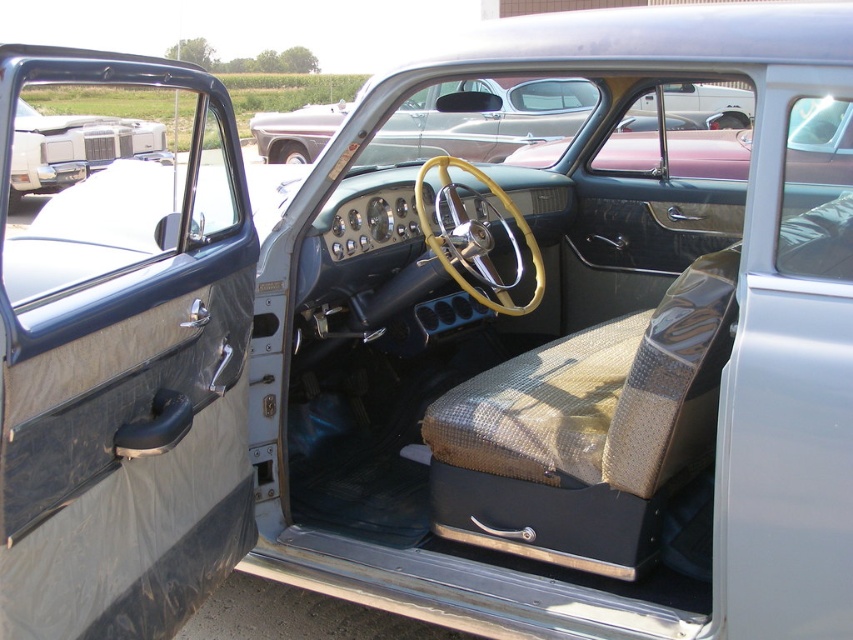
You are a delivery driver who needs to park your truck in a narrow alley. The alley is just wide enough for the metallic red pickup truck at center. Can the matte gray door at left fit through the same alley without opening wider?

The matte gray door at left is wider than the metallic red pickup truck at center, so it cannot fit through the alley without opening wider.

You are standing outside the matte gray door at left and want to enter the metallic red pickup truck at center. Which direction should you move to reach the truck?

You should move to the right because the matte gray door at left is positioned on the left side of the metallic red pickup truck at center, so moving right would bring you towards the truck.